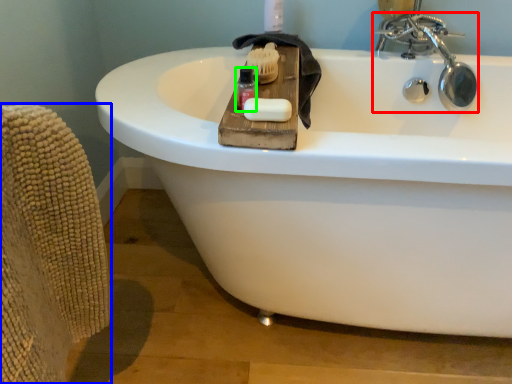
Question: Estimate the real-world distances between objects in this image. Which object is farther from tap (highlighted by a red box), armchair (highlighted by a blue box) or mouthwash (highlighted by a green box)?

Choices:
 (A) armchair
 (B) mouthwash

Answer: (A)